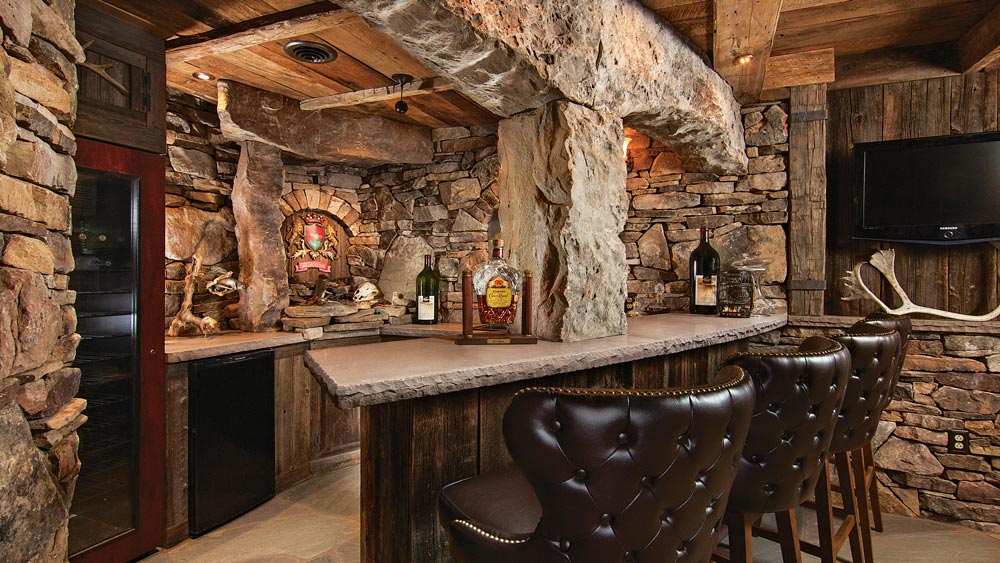
Where is `light`? This screenshot has width=1000, height=563. light is located at coordinates (403, 111).